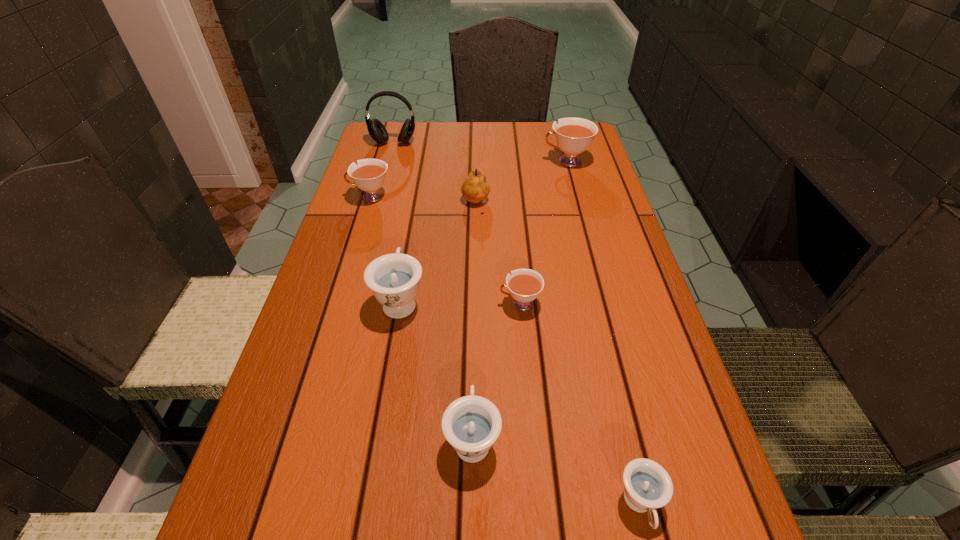
Where is `headset that is at the left edge`? This screenshot has width=960, height=540. headset that is at the left edge is located at coordinates (377, 131).

Find the location of a particular element. The image size is (960, 540). object positioned at the far left corner is located at coordinates click(x=377, y=131).

The image size is (960, 540). I want to click on object that is at the far right corner, so click(573, 135).

Image resolution: width=960 pixels, height=540 pixels. Find the location of `free space at the left edge`. free space at the left edge is located at coordinates (377, 320).

Locate an element on the screen. This screenshot has width=960, height=540. free space at the right edge of the desktop is located at coordinates (572, 174).

Where is `free space at the far left corner of the desktop`? Image resolution: width=960 pixels, height=540 pixels. free space at the far left corner of the desktop is located at coordinates (374, 152).

Find the location of `free space between the pear and the second blue teacup from left to right`. free space between the pear and the second blue teacup from left to right is located at coordinates (474, 321).

The height and width of the screenshot is (540, 960). In order to click on free space between the second blue teacup from left to right and the second smallest white teacup in this screenshot , I will do [x=421, y=318].

The width and height of the screenshot is (960, 540). What are the coordinates of `empty space that is in between the black headset and the second blue teacup from right to left` in the screenshot? It's located at point(433,290).

Locate an element on the screen. vacant area that lies between the leftmost white teacup and the second smallest blue teacup is located at coordinates (421, 318).